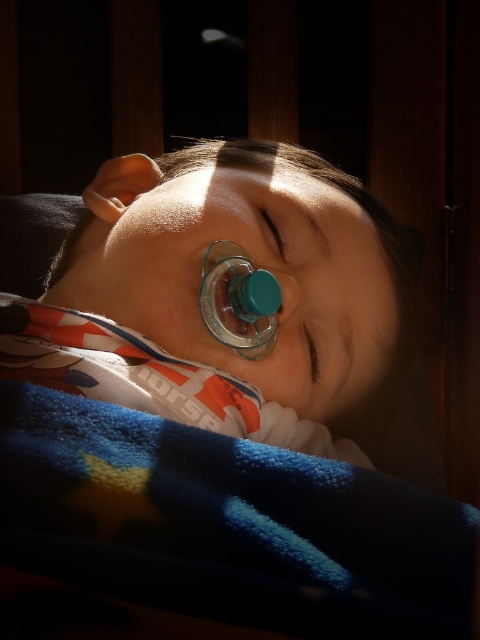
You are a pediatrician examining a sleeping child. You notice the transparent plastic pacifier at center and the brown matte eye at center. Which object is positioned higher on the child?

The transparent plastic pacifier at center is taller than the brown matte eye at center, so the transparent plastic pacifier at center is positioned higher on the child.

You are a photographer taking a picture of a sleeping child. You notice a point at coordinates point (36,499) that needs to be in focus. If your camera has a depth of field that can focus on objects within 30 centimeters from the lens, will this point be in focus?

The point (36,499) is 30.45 centimeters from the camera, which is slightly beyond the 30 centimeter depth of field range. Therefore, this point will not be in focus.

A parent is trying to locate their child who is sleeping in a crib. They remember placing a pacifier somewhere near the child. Based on the scene, where exactly is the transparent plastic pacifier at center located?

The transparent plastic pacifier at center is located at point (220, 296).